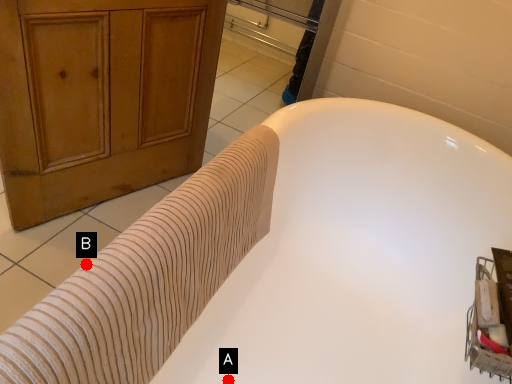
Question: Two points are circled on the image, labeled by A and B beside each circle. Which point is closer to the camera?

Choices:
 (A) A is closer
 (B) B is closer

Answer: (B)